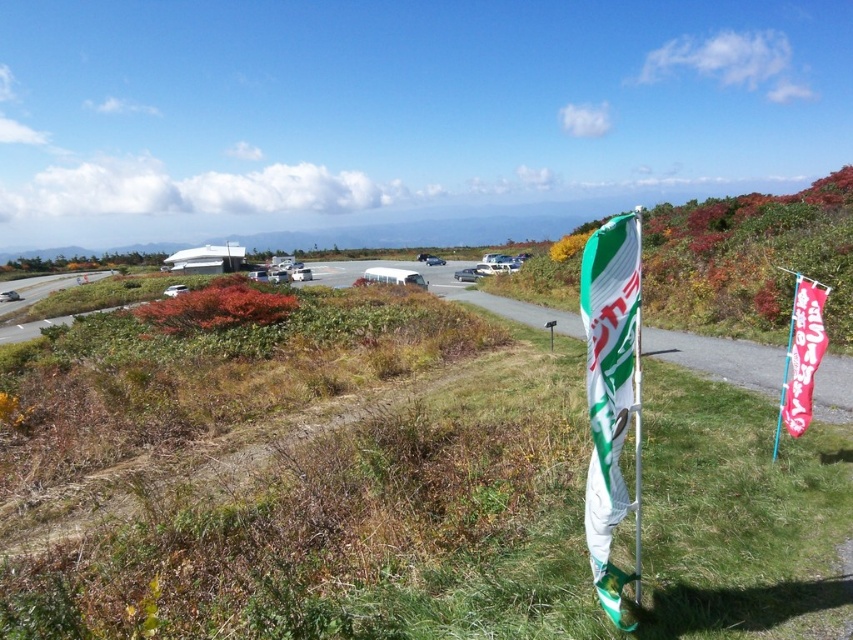
Question: Does white fabric flag at right appear on the left side of red fabric flag at right?

Choices:
 (A) yes
 (B) no

Answer: (A)

Question: Which point is farther from the camera taking this photo?

Choices:
 (A) click(788, 362)
 (B) click(262, 592)

Answer: (A)

Question: Which object appears farthest from the camera in this image?

Choices:
 (A) green grass at center
 (B) white fabric flag at right

Answer: (B)

Question: Does green grass at center come behind red fabric flag at right?

Choices:
 (A) yes
 (B) no

Answer: (B)

Question: Among these points, which one is nearest to the camera?

Choices:
 (A) (364, 321)
 (B) (631, 342)
 (C) (793, 301)

Answer: (B)

Question: Does green grass at center appear under red fabric flag at right?

Choices:
 (A) no
 (B) yes

Answer: (B)